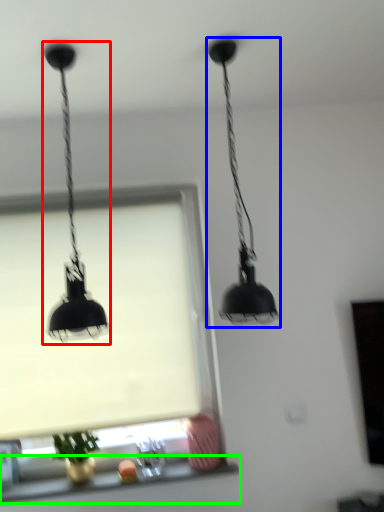
Question: Which object is positioned farthest from lamp (highlighted by a red box)? Select from lamp (highlighted by a blue box) and window sill (highlighted by a green box).

Choices:
 (A) lamp
 (B) window sill

Answer: (B)